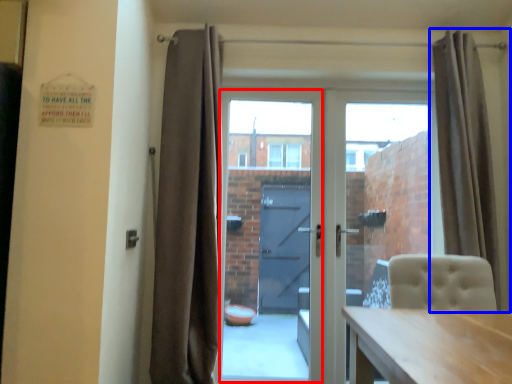
Question: Which point is further to the camera, glass door (highlighted by a red box) or curtain (highlighted by a blue box)?

Choices:
 (A) glass door
 (B) curtain

Answer: (A)